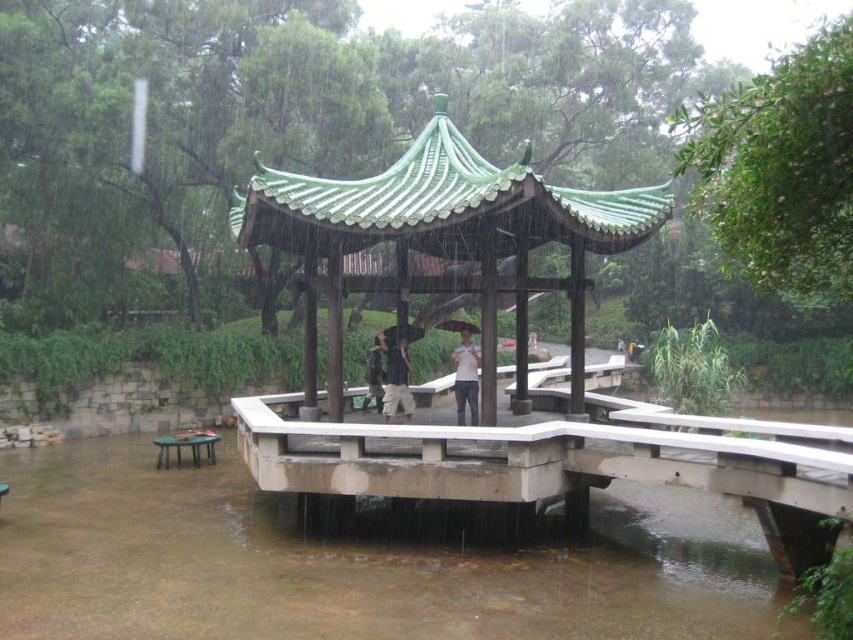
Can you confirm if green glazed tile gazebo at center is thinner than black matte umbrella at center?

Incorrect, green glazed tile gazebo at center's width is not less than black matte umbrella at center's.

Does green glazed tile gazebo at center appear under black matte umbrella at center?

Actually, green glazed tile gazebo at center is above black matte umbrella at center.

In order to click on green glazed tile gazebo at center in this screenshot , I will do `click(442, 243)`.

Where is `green glazed tile gazebo at center`? The height and width of the screenshot is (640, 853). green glazed tile gazebo at center is located at coordinates click(442, 243).

In the scene shown: Can you confirm if clear concrete flood at lower center is bigger than green glossy picnic table at lower left?

Yes.

Does clear concrete flood at lower center appear under green glossy picnic table at lower left?

Indeed, clear concrete flood at lower center is positioned under green glossy picnic table at lower left.

Where is `clear concrete flood at lower center`? Image resolution: width=853 pixels, height=640 pixels. clear concrete flood at lower center is located at coordinates (358, 561).

Is point (390, 396) closer to viewer compared to point (412, 332)?

Yes.

Between dark gray fabric umbrella at center and transparent plastic umbrella at center, which one is positioned higher?

transparent plastic umbrella at center is above.

The image size is (853, 640). I want to click on dark gray fabric umbrella at center, so click(x=395, y=376).

Locate an element on the screen. The image size is (853, 640). dark gray fabric umbrella at center is located at coordinates (395, 376).